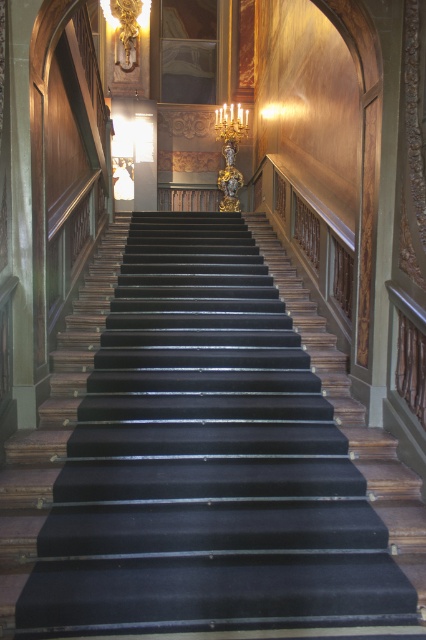
Question: Which point appears farthest from the camera in this image?

Choices:
 (A) (241, 108)
 (B) (95, 547)

Answer: (A)

Question: Does black velvet stairs at center have a lesser width compared to gold metallic chandelier at upper center?

Choices:
 (A) no
 (B) yes

Answer: (A)

Question: Considering the relative positions of black velvet stairs at center and gold metallic chandelier at upper center in the image provided, where is black velvet stairs at center located with respect to gold metallic chandelier at upper center?

Choices:
 (A) below
 (B) above

Answer: (A)

Question: Can you confirm if black velvet stairs at center is positioned below gold metallic chandelier at upper center?

Choices:
 (A) yes
 (B) no

Answer: (A)